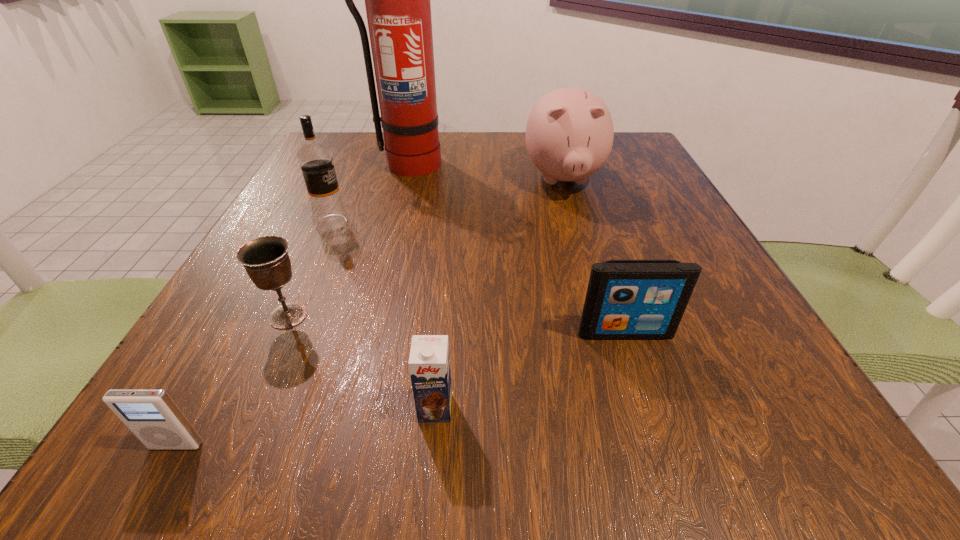
In order to click on vodka that is at the left edge in this screenshot , I will do `click(315, 159)`.

Where is `chalice present at the left edge`? This screenshot has height=540, width=960. chalice present at the left edge is located at coordinates (266, 260).

Locate an element on the screen. The image size is (960, 540). iPod that is at the left edge is located at coordinates (151, 415).

Where is `piggy bank at the right edge`? piggy bank at the right edge is located at coordinates (569, 134).

Locate an element on the screen. The image size is (960, 540). iPod situated at the right edge is located at coordinates (626, 299).

This screenshot has height=540, width=960. Identify the location of object that is positioned at the far left corner. (397, 0).

Where is `object located in the near left corner section of the desktop`? object located in the near left corner section of the desktop is located at coordinates (151, 415).

Identify the location of object present at the far right corner. The height and width of the screenshot is (540, 960). (569, 134).

At what (x,y) coordinates should I click in order to perform the action: click on blank space at the far edge of the desktop. Please return your answer as a coordinate pair (x, y). This screenshot has height=540, width=960. Looking at the image, I should click on (487, 155).

The width and height of the screenshot is (960, 540). I want to click on vacant space at the left edge, so click(310, 236).